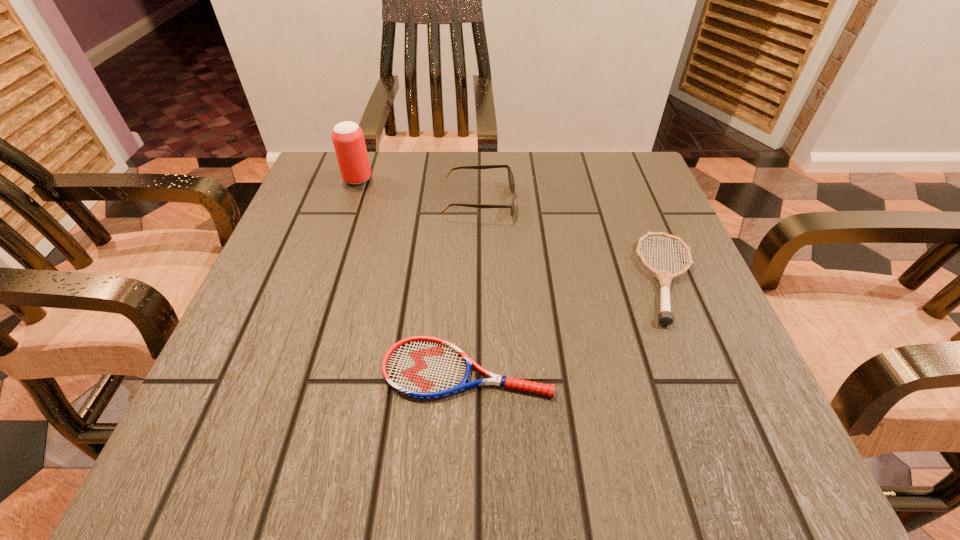
Where is `vacant area at the far left corner of the desktop`? The width and height of the screenshot is (960, 540). vacant area at the far left corner of the desktop is located at coordinates (302, 197).

Locate an element on the screen. The image size is (960, 540). free location at the far right corner is located at coordinates [x=601, y=165].

Locate an element on the screen. free space at the near right corner of the desktop is located at coordinates (717, 476).

Where is `free spot between the rightmost object and the third shortest object`? The height and width of the screenshot is (540, 960). free spot between the rightmost object and the third shortest object is located at coordinates (574, 240).

Locate an element on the screen. This screenshot has height=540, width=960. free space between the right tennis racket and the shortest object is located at coordinates (568, 323).

At what (x,y) coordinates should I click in order to perform the action: click on free space between the sunglasses and the nearer tennis racket. Please return your answer as a coordinate pair (x, y). Looking at the image, I should click on (473, 285).

Identify the location of free space between the second tallest object and the shorter tennis racket. The image size is (960, 540). (473, 285).

Identify the location of free area in between the taller tennis racket and the beer can. [x=514, y=228].

The width and height of the screenshot is (960, 540). Identify the location of vacant region between the leftmost object and the second tallest object. (419, 190).

This screenshot has width=960, height=540. Find the location of `free space between the shortest object and the right tennis racket`. free space between the shortest object and the right tennis racket is located at coordinates [x=568, y=323].